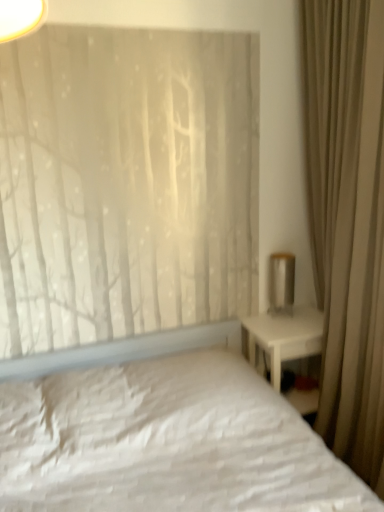
Question: Can you confirm if matte white rectangular at upper right is thinner than beige fabric curtain at right?

Choices:
 (A) no
 (B) yes

Answer: (B)

Question: Is matte white rectangular at upper right behind beige fabric curtain at right?

Choices:
 (A) yes
 (B) no

Answer: (A)

Question: Does matte white rectangular at upper right have a larger size compared to beige fabric curtain at right?

Choices:
 (A) yes
 (B) no

Answer: (B)

Question: From a real-world perspective, does matte white rectangular at upper right stand above beige fabric curtain at right?

Choices:
 (A) yes
 (B) no

Answer: (B)

Question: Considering the relative positions of matte white rectangular at upper right and beige fabric curtain at right in the image provided, is matte white rectangular at upper right to the right of beige fabric curtain at right from the viewer's perspective?

Choices:
 (A) no
 (B) yes

Answer: (A)

Question: Does matte white rectangular at upper right have a greater width compared to beige fabric curtain at right?

Choices:
 (A) yes
 (B) no

Answer: (B)

Question: Is beige fabric curtain at right smaller than matte white rectangular at upper right?

Choices:
 (A) no
 (B) yes

Answer: (A)

Question: Can you confirm if beige fabric curtain at right is wider than matte white rectangular at upper right?

Choices:
 (A) no
 (B) yes

Answer: (B)

Question: Is beige fabric curtain at right not within matte white rectangular at upper right?

Choices:
 (A) no
 (B) yes

Answer: (B)

Question: Is beige fabric curtain at right looking in the opposite direction of matte white rectangular at upper right?

Choices:
 (A) yes
 (B) no

Answer: (B)

Question: From a real-world perspective, is beige fabric curtain at right located higher than matte white rectangular at upper right?

Choices:
 (A) no
 (B) yes

Answer: (B)

Question: Does beige fabric curtain at right have a lesser height compared to matte white rectangular at upper right?

Choices:
 (A) no
 (B) yes

Answer: (A)

Question: Visually, is beige fabric curtain at right positioned to the left or to the right of matte white rectangular at upper right?

Choices:
 (A) right
 (B) left

Answer: (A)